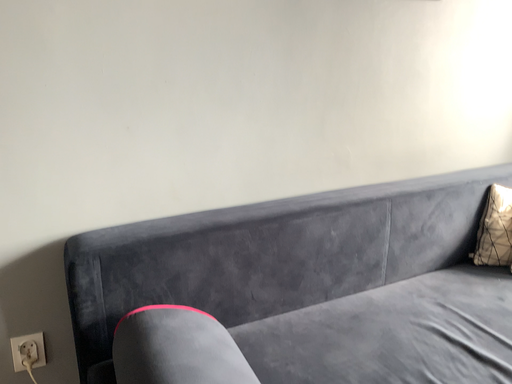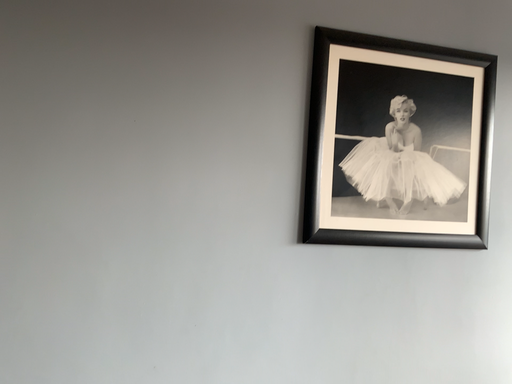
Question: Which way did the camera rotate in the video?

Choices:
 (A) rotated downward
 (B) rotated upward

Answer: (B)